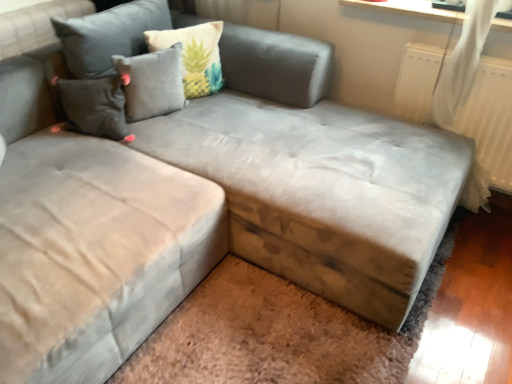
Locate an element on the screen. vacant space underneath brown wood storage at lower right (from a real-world perspective) is located at coordinates (288, 335).